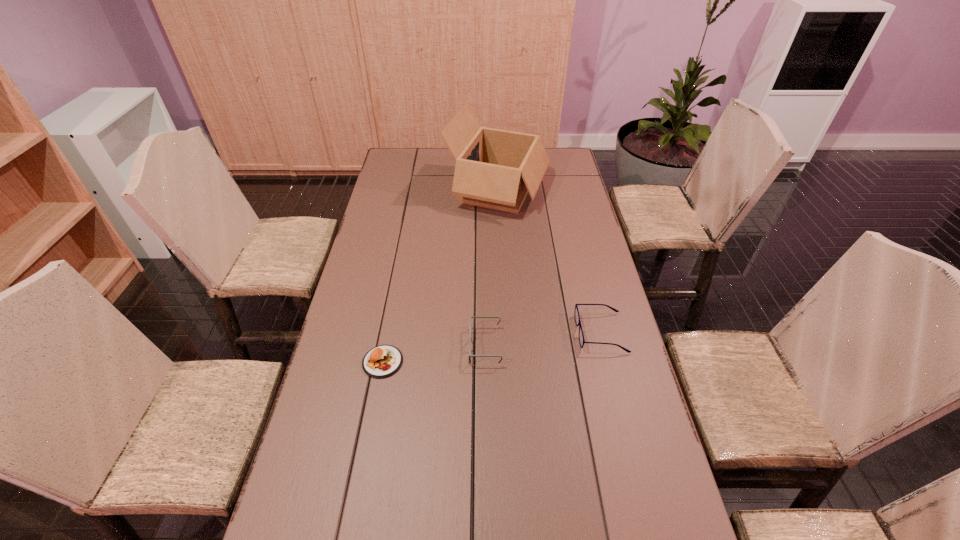
The image size is (960, 540). Identify the location of vacant region at the right edge of the desktop. (615, 374).

At what (x,y) coordinates should I click in order to perform the action: click on free space between the tallest object and the right spectacles. Please return your answer as a coordinate pair (x, y). This screenshot has width=960, height=540. Looking at the image, I should click on (549, 261).

Locate an element on the screen. This screenshot has width=960, height=540. free space that is in between the right spectacles and the farthest object is located at coordinates (549, 261).

This screenshot has height=540, width=960. I want to click on blank region between the left spectacles and the right spectacles, so click(x=543, y=339).

What are the coordinates of `vacant area between the right spectacles and the shortest object` in the screenshot? It's located at (492, 347).

Image resolution: width=960 pixels, height=540 pixels. I want to click on vacant space that's between the shortest object and the farthest object, so click(x=441, y=275).

At what (x,y) coordinates should I click in order to perform the action: click on unoccupied area between the right spectacles and the left spectacles. Please return your answer as a coordinate pair (x, y). This screenshot has height=540, width=960. Looking at the image, I should click on (543, 339).

At what (x,y) coordinates should I click in order to perform the action: click on unoccupied area between the right spectacles and the tallest object. Please return your answer as a coordinate pair (x, y). Looking at the image, I should click on (549, 261).

Find the location of `vacant area between the right spectacles and the tallest object`. vacant area between the right spectacles and the tallest object is located at coordinates (549, 261).

The image size is (960, 540). Identify the location of vacant area that lies between the left spectacles and the farthest object. (492, 267).